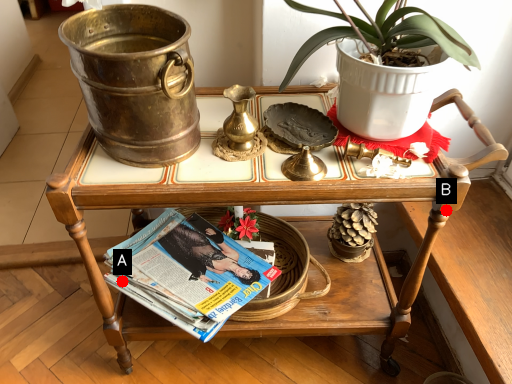
Question: Two points are circled on the image, labeled by A and B beside each circle. Which of the following is the farthest from the observer?

Choices:
 (A) A is further
 (B) B is further

Answer: (A)